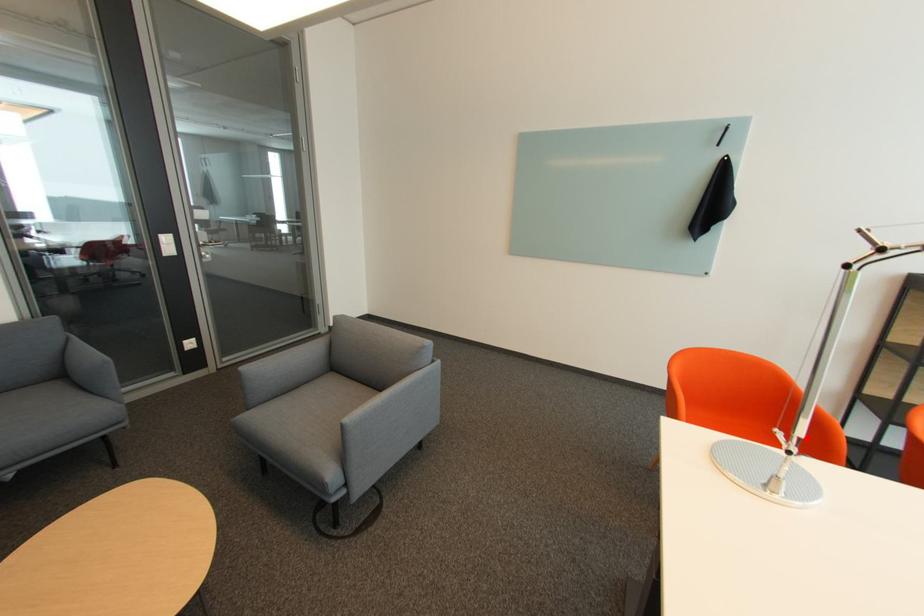
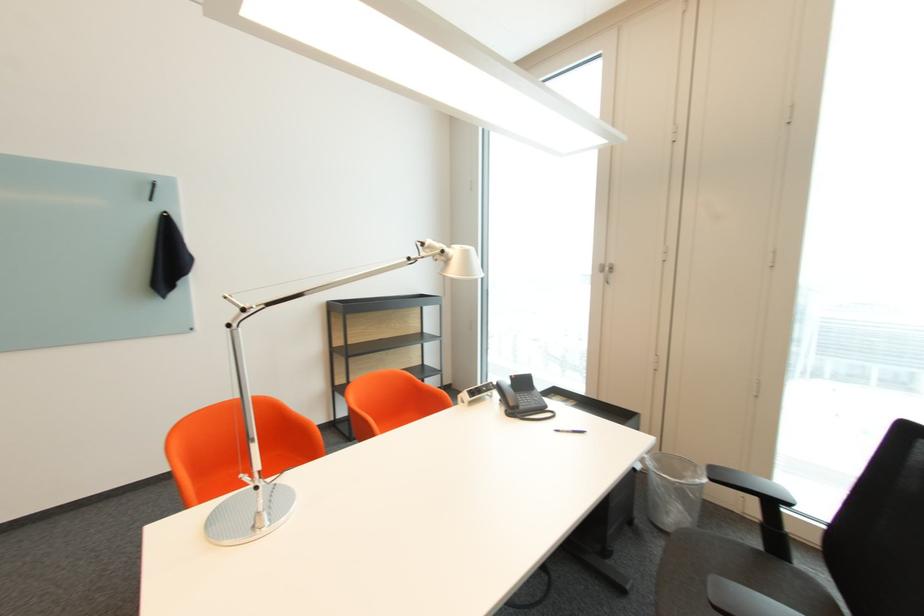
Question: I am providing you with two images of the same scene from different viewpoints. A red point is marked on the first image. Is the red point's position out of view in image 2?

Choices:
 (A) Yes
 (B) No

Answer: (B)